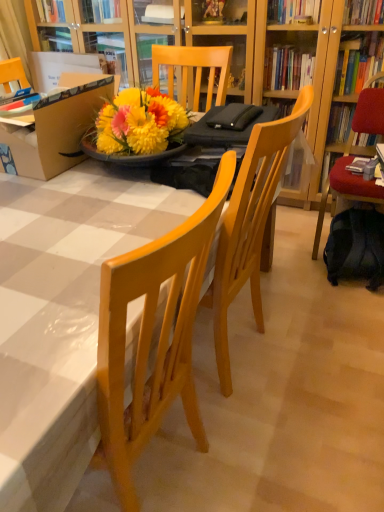
Find the location of a particular element. The width and height of the screenshot is (384, 512). hardcover book at right is located at coordinates (359, 165).

Measure the distance between point (331, 176) and camera.

6.93 feet.

Locate an element on the screen. wooden table at center is located at coordinates (62, 316).

Is hardcover book at right positioned in front of velvet red chair at right?

That is False.

Considering the sizes of objects hardcover book at right and velvet red chair at right in the image provided, who is taller, hardcover book at right or velvet red chair at right?

Standing taller between the two is velvet red chair at right.

Between point (355, 157) and point (361, 105), which one is positioned in front?

The point (361, 105) is closer to the camera.

Does hardcover book at right have a larger size compared to velvet red chair at right?

No, hardcover book at right is not bigger than velvet red chair at right.

Is velvet red chair at right to the right of wooden table at center from the viewer's perspective?

Indeed, velvet red chair at right is positioned on the right side of wooden table at center.

How many degrees apart are the facing directions of velvet red chair at right and wooden table at center?

velvet red chair at right and wooden table at center are facing 89.8 degrees away from each other.

In terms of size, does velvet red chair at right appear bigger or smaller than wooden table at center?

Clearly, velvet red chair at right is smaller in size than wooden table at center.

Is velvet red chair at right not near wooden table at center?

Yes, velvet red chair at right and wooden table at center are located far from each other.

Between hardcover book at right and matte cardboard box at upper left, which one has more height?

Standing taller between the two is matte cardboard box at upper left.

Is hardcover book at right looking in the opposite direction of matte cardboard box at upper left?

No.

Looking at the image, does hardcover book at right seem bigger or smaller compared to matte cardboard box at upper left?

In the image, hardcover book at right appears to be smaller than matte cardboard box at upper left.

Where is `book below the matte cardboard box at upper left (from a real-world perspective)`? This screenshot has height=512, width=384. book below the matte cardboard box at upper left (from a real-world perspective) is located at coordinates (359, 165).

Between matte cardboard box at upper left and hardcover book at right, which one has less height?

hardcover book at right is shorter.

From the picture: From a real-world perspective, who is located higher, matte cardboard box at upper left or hardcover book at right?

matte cardboard box at upper left.

Is matte cardboard box at upper left turned away from hardcover book at right?

No.

Does matte cardboard box at upper left have a lesser width compared to hardcover book at right?

Incorrect, the width of matte cardboard box at upper left is not less than that of hardcover book at right.

The height and width of the screenshot is (512, 384). In order to click on desk on the right of the matte cardboard box at upper left in this screenshot , I will do `click(62, 316)`.

Looking at this image, is wooden table at center bigger or smaller than matte cardboard box at upper left?

Considering their sizes, wooden table at center takes up more space than matte cardboard box at upper left.

Is the surface of wooden table at center in direct contact with matte cardboard box at upper left?

wooden table at center and matte cardboard box at upper left are not in contact.

Considering the positions of points (63, 411) and (5, 144), is point (63, 411) farther from camera compared to point (5, 144)?

No, (63, 411) is in front of (5, 144).

Is hardcover book at right inside the boundaries of wooden table at center, or outside?

The correct answer is: outside.

What are the coordinates of `book that appears above the wooden table at center (from the image's perspective)` in the screenshot? It's located at (359, 165).

From a real-world perspective, is hardcover book at right beneath wooden table at center?

Incorrect, from a real-world perspective, hardcover book at right is higher than wooden table at center.

Is velvet red chair at right touching dark blue fabric backpack at lower right?

No, velvet red chair at right is not in contact with dark blue fabric backpack at lower right.

Considering the sizes of velvet red chair at right and dark blue fabric backpack at lower right in the image, is velvet red chair at right taller or shorter than dark blue fabric backpack at lower right?

velvet red chair at right is taller than dark blue fabric backpack at lower right.

Could you tell me if velvet red chair at right is turned towards dark blue fabric backpack at lower right?

Yes, velvet red chair at right is facing dark blue fabric backpack at lower right.

From the image's perspective, is velvet red chair at right on top of dark blue fabric backpack at lower right?

Yes, from the image's perspective, velvet red chair at right is above dark blue fabric backpack at lower right.

Identify the location of book above the velvet red chair at right (from a real-world perspective). The height and width of the screenshot is (512, 384). (359, 165).

In order to click on chair located on the right of wooden table at center in this screenshot , I will do `click(353, 157)`.

From the image, which object appears to be nearer to velvet red chair at right, hardcover book at right or wooden table at center?

hardcover book at right lies closer to velvet red chair at right than the other object.

From the image, which object appears to be nearer to wooden table at center, matte cardboard box at upper left or velvet red chair at right?

matte cardboard box at upper left is closer to wooden table at center.

Considering their positions, is hardcover book at right positioned closer to matte cardboard box at upper left than wooden table at center?

wooden table at center is closer to matte cardboard box at upper left.

When comparing their distances from dark blue fabric backpack at lower right, does wooden table at center or hardcover book at right seem closer?

hardcover book at right.

From the image, which object appears to be farther from matte cardboard box at upper left, velvet red chair at right or wooden table at center?

The object further to matte cardboard box at upper left is velvet red chair at right.

From the image, which object appears to be nearer to matte cardboard box at upper left, wooden table at center or dark blue fabric backpack at lower right?

wooden table at center is positioned closer to the anchor matte cardboard box at upper left.

Estimate the real-world distances between objects in this image. Which object is closer to matte cardboard box at upper left, velvet red chair at right or dark blue fabric backpack at lower right?

velvet red chair at right is positioned closer to the anchor matte cardboard box at upper left.

Based on their spatial positions, is velvet red chair at right or hardcover book at right closer to dark blue fabric backpack at lower right?

velvet red chair at right lies closer to dark blue fabric backpack at lower right than the other object.

The width and height of the screenshot is (384, 512). I want to click on book situated between matte cardboard box at upper left and velvet red chair at right from left to right, so click(359, 165).

Image resolution: width=384 pixels, height=512 pixels. I want to click on desk between matte cardboard box at upper left and dark blue fabric backpack at lower right, so click(x=62, y=316).

The height and width of the screenshot is (512, 384). What are the coordinates of `chair between hardcover book at right and dark blue fabric backpack at lower right from top to bottom` in the screenshot? It's located at (353, 157).

Identify the location of desk located between matte cardboard box at upper left and velvet red chair at right in the left-right direction. (62, 316).